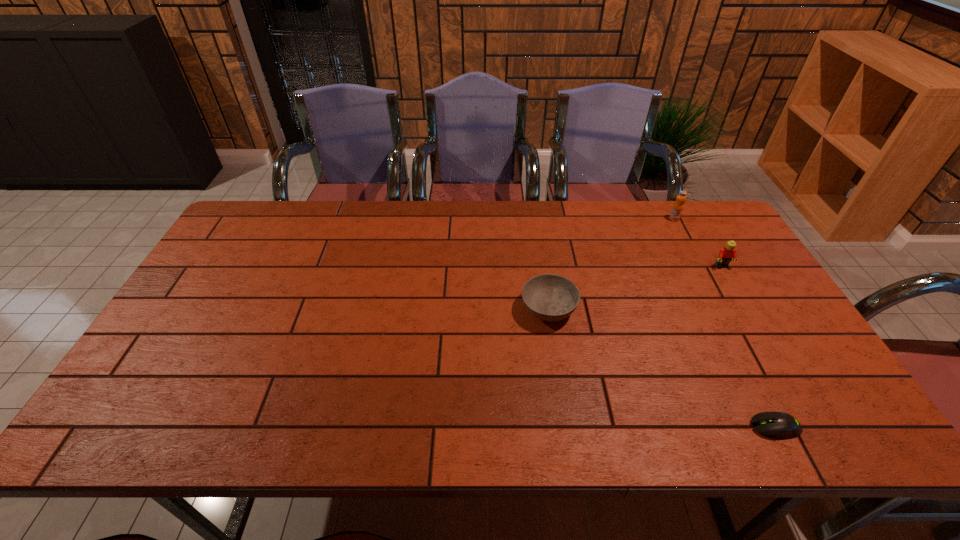
Where is `free point that satisfies the following two spatial constraints: 1. on the face of the rightmost object; 2. on the wheel side of the computer mouse`? free point that satisfies the following two spatial constraints: 1. on the face of the rightmost object; 2. on the wheel side of the computer mouse is located at coordinates (815, 427).

Locate an element on the screen. vacant space that satisfies the following two spatial constraints: 1. on the front label of the farthest object; 2. on the wheel side of the nearest object is located at coordinates (783, 427).